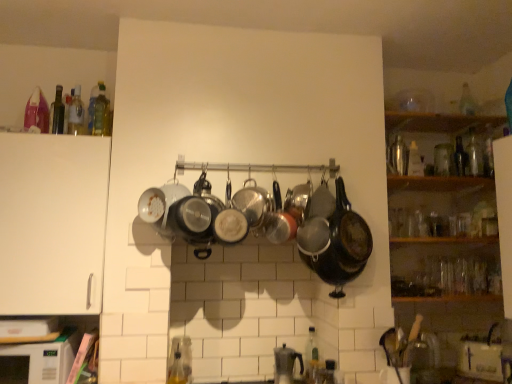
Question: Can transparent glass bottle at upper right, the third bottle positioned from the right, be found inside white matte cabinet at left?

Choices:
 (A) yes
 (B) no

Answer: (B)

Question: Does white matte cabinet at left have a greater height compared to transparent glass bottle at upper right, the 7th bottle in the left-to-right sequence?

Choices:
 (A) no
 (B) yes

Answer: (B)

Question: Does white matte cabinet at left appear on the left side of transparent glass bottle at upper right, the 7th bottle in the left-to-right sequence?

Choices:
 (A) yes
 (B) no

Answer: (A)

Question: From the image's perspective, does white matte cabinet at left appear higher than transparent glass bottle at upper right, the third bottle positioned from the right?

Choices:
 (A) no
 (B) yes

Answer: (A)

Question: Considering the relative sizes of white matte cabinet at left and transparent glass bottle at upper right, the third bottle positioned from the right, in the image provided, is white matte cabinet at left bigger than transparent glass bottle at upper right, the third bottle positioned from the right,?

Choices:
 (A) yes
 (B) no

Answer: (A)

Question: Is transparent glass bottle at upper right, arranged as the 1th bottle when viewed from the right, to the left or to the right of white matte cabinet at left in the image?

Choices:
 (A) left
 (B) right

Answer: (B)

Question: Considering the positions of transparent glass bottle at upper right, which is the 1th bottle in back-to-front order, and white matte cabinet at left in the image, is transparent glass bottle at upper right, which is the 1th bottle in back-to-front order, taller or shorter than white matte cabinet at left?

Choices:
 (A) tall
 (B) short

Answer: (B)

Question: From a real-world perspective, is transparent glass bottle at upper right, acting as the 9th bottle starting from the front, physically located above or below white matte cabinet at left?

Choices:
 (A) below
 (B) above

Answer: (B)

Question: Is transparent glass bottle at upper right, acting as the 9th bottle starting from the front, inside the boundaries of white matte cabinet at left, or outside?

Choices:
 (A) outside
 (B) inside

Answer: (A)

Question: Considering the relative positions of green glass bottle at upper left, marked as the 1th bottle in a left-to-right arrangement, and shiny black wok at center in the image provided, is green glass bottle at upper left, marked as the 1th bottle in a left-to-right arrangement, to the left or to the right of shiny black wok at center?

Choices:
 (A) right
 (B) left

Answer: (B)

Question: Considering their positions, is green glass bottle at upper left, the ninth bottle in the right-to-left sequence, located in front of or behind shiny black wok at center?

Choices:
 (A) behind
 (B) front

Answer: (A)

Question: Is green glass bottle at upper left, the ninth bottle in the right-to-left sequence, bigger or smaller than shiny black wok at center?

Choices:
 (A) big
 (B) small

Answer: (B)

Question: Is green glass bottle at upper left, the 3th bottle positioned from the front, inside or outside of shiny black wok at center?

Choices:
 (A) inside
 (B) outside

Answer: (B)

Question: From a real-world perspective, relative to translucent glass bottle at upper left, which is counted as the 2th bottle, starting from the left, is translucent glass bottle at upper left, placed as the fifth bottle when sorted from back to front, vertically above or below?

Choices:
 (A) below
 (B) above

Answer: (B)

Question: Is translucent glass bottle at upper left, the fifth bottle when ordered from front to back, to the left or to the right of translucent glass bottle at upper left, the 6th bottle positioned from the back, in the image?

Choices:
 (A) left
 (B) right

Answer: (B)